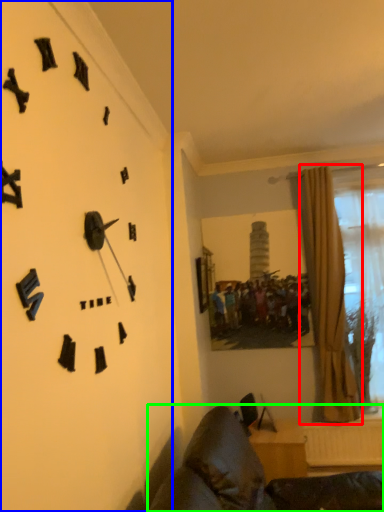
Question: Based on their relative distances, which object is nearer to curtain (highlighted by a red box)? Choose from wall clock (highlighted by a blue box) and furniture (highlighted by a green box).

Choices:
 (A) wall clock
 (B) furniture

Answer: (B)